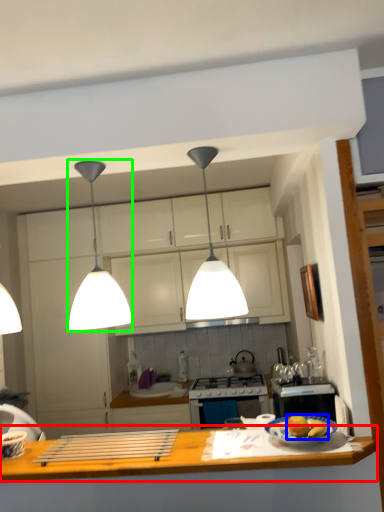
Question: Which object is positioned farthest from countertop (highlighted by a red box)? Select from apple (highlighted by a blue box) and light (highlighted by a green box).

Choices:
 (A) apple
 (B) light

Answer: (B)